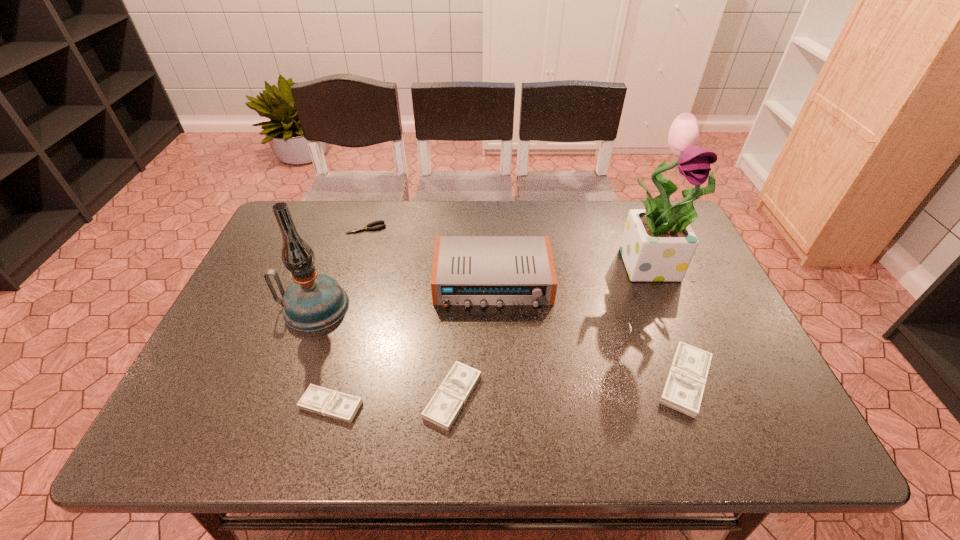
Find the location of a particular element. The width and height of the screenshot is (960, 540). vacant space that's between the rightmost money and the second shortest money is located at coordinates (569, 388).

I want to click on vacant space that's between the flower arrangement and the rightmost money, so click(x=669, y=322).

The width and height of the screenshot is (960, 540). What are the coordinates of `free spot between the third shortest object and the leftmost money` in the screenshot? It's located at (392, 401).

Identify the location of unoccupied position between the leftmost money and the fifth shortest object. (412, 343).

This screenshot has height=540, width=960. In order to click on unoccupied position between the radio receiver and the farthest object in this screenshot , I will do `click(430, 255)`.

I want to click on unoccupied area between the second money from left to right and the flower arrangement, so click(553, 330).

Identify the location of free space that is in between the second shortest object and the rightmost money. (508, 393).

This screenshot has height=540, width=960. I want to click on free space between the radio receiver and the second shortest object, so click(412, 343).

Choose which object is the sixth nearest neighbor to the radio receiver. Please provide its 2D coordinates. Your answer should be formatted as a tuple, i.e. [(x, y)], where the tuple contains the x and y coordinates of a point satisfying the conditions above.

[(316, 399)]

Find the location of a particular element. object that is the third closest to the oil lamp is located at coordinates (367, 227).